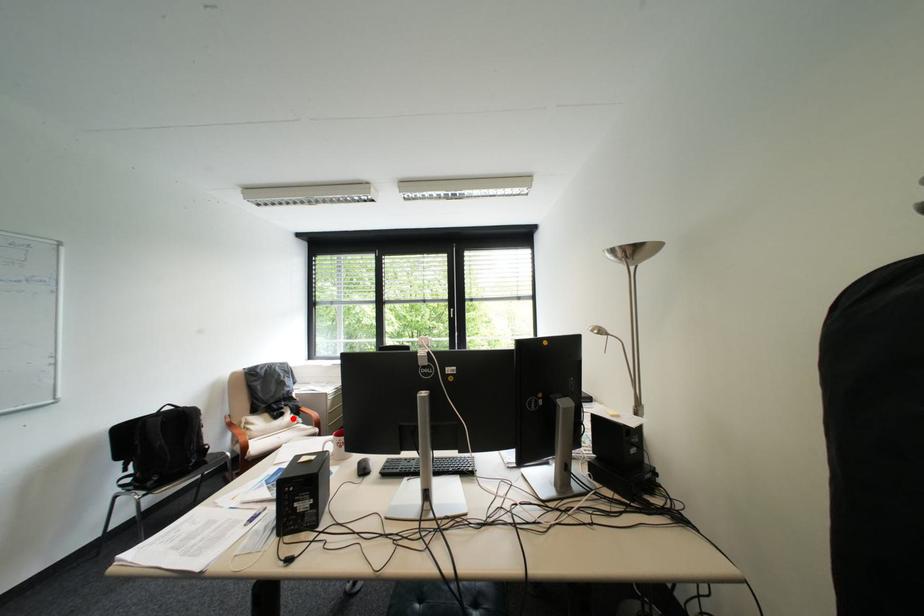
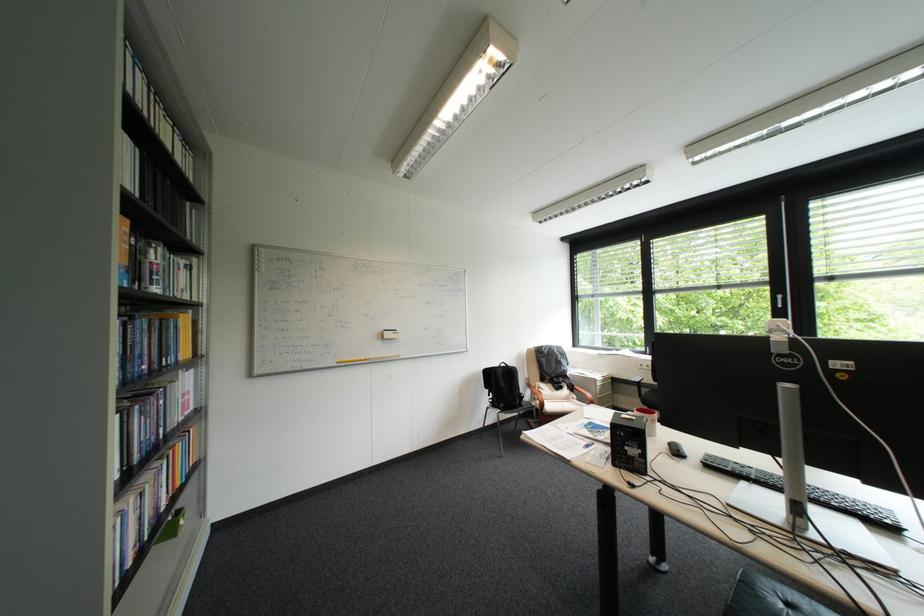
Locate, in the second image, the point that corresponds to the highlighted location in the first image.

(573, 391)